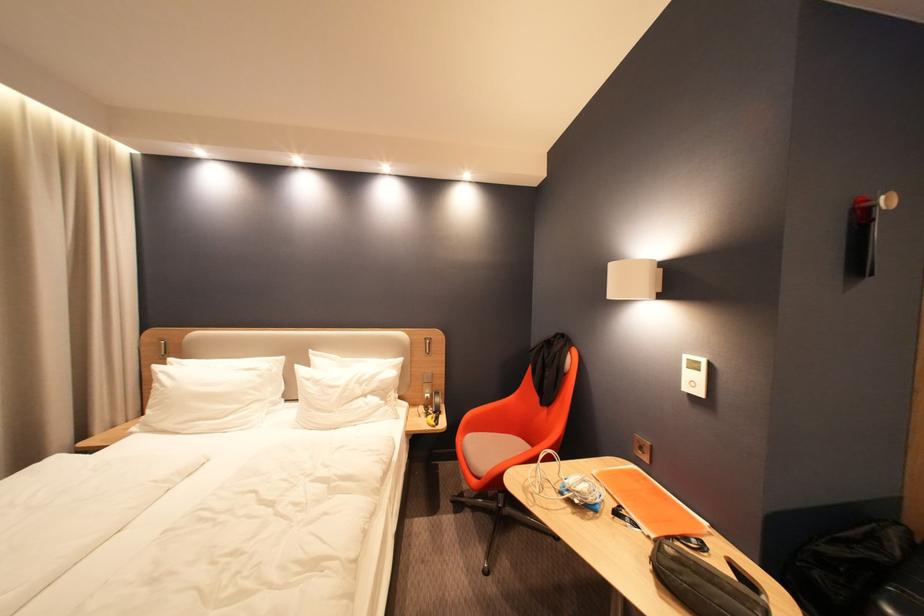
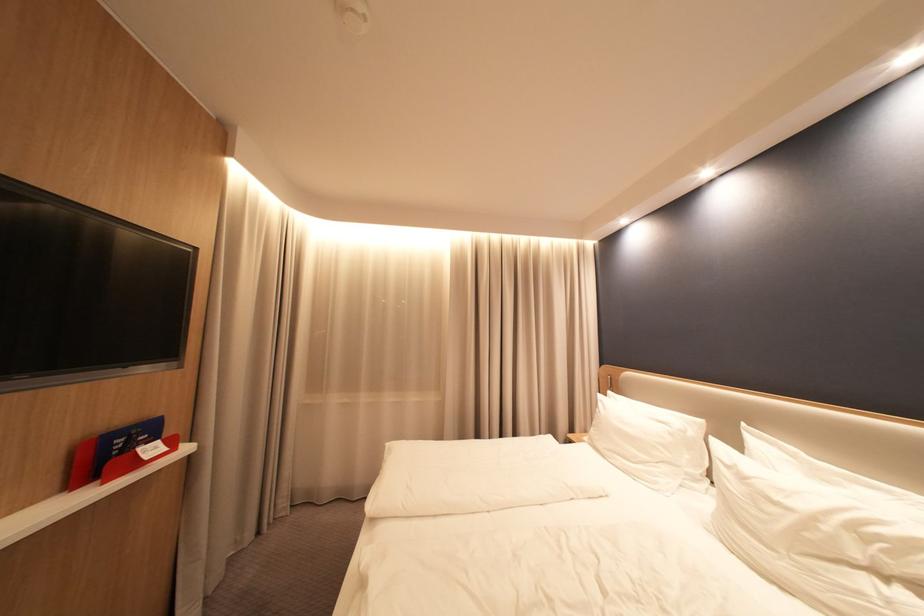
Question: Based on the continuous images, in which direction is the camera rotating? Reply with the corresponding letter.

Choices:
 (A) Left
 (B) Right
 (C) Up
 (D) Down

Answer: (A)